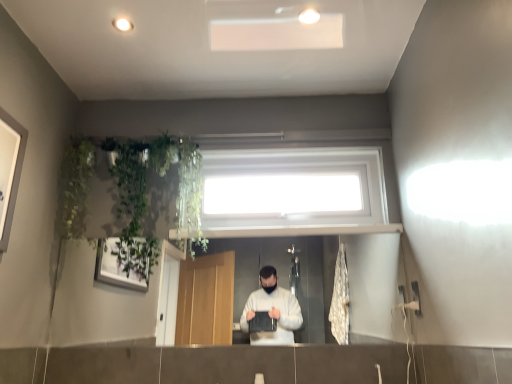
The width and height of the screenshot is (512, 384). In order to click on vacant location below white plastic window at upper center (from a real-world perspective) in this screenshot , I will do `click(292, 227)`.